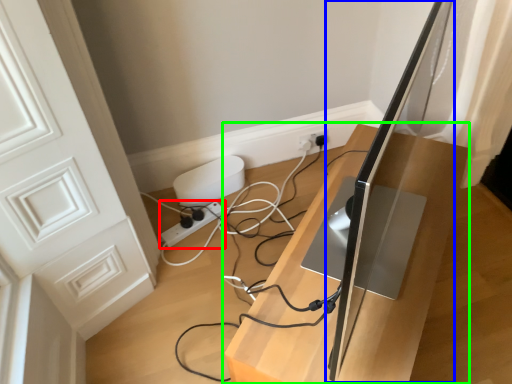
Question: Which object is the farthest from extension cord (highlighted by a red box)? Choose among these: computer monitor (highlighted by a blue box) or furniture (highlighted by a green box).

Choices:
 (A) computer monitor
 (B) furniture

Answer: (A)